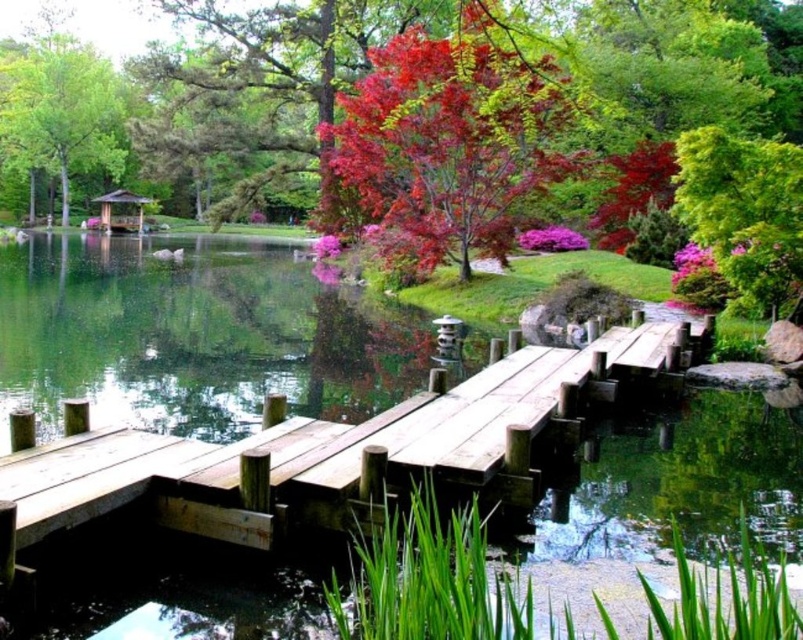
Question: Among these objects, which one is nearest to the camera?

Choices:
 (A) green matte tree at upper left
 (B) wooden gazebo at center
 (C) vivid red leaves at upper center

Answer: (C)

Question: Can you confirm if vivid red leaves at upper center is thinner than wooden gazebo at center?

Choices:
 (A) no
 (B) yes

Answer: (A)

Question: Is green leafy tree at upper right above wooden gazebo at center?

Choices:
 (A) no
 (B) yes

Answer: (A)

Question: Is wooden dock at center to the right of wooden gazebo at center from the viewer's perspective?

Choices:
 (A) yes
 (B) no

Answer: (A)

Question: Which object is positioned farthest from the green leafy tree at upper right?

Choices:
 (A) wooden gazebo at center
 (B) green matte tree at upper left
 (C) wooden dock at center

Answer: (B)

Question: Among these objects, which one is farthest from the camera?

Choices:
 (A) green matte tree at upper left
 (B) wooden gazebo at center
 (C) vivid red leaves at upper center
 (D) wooden dock at center

Answer: (B)